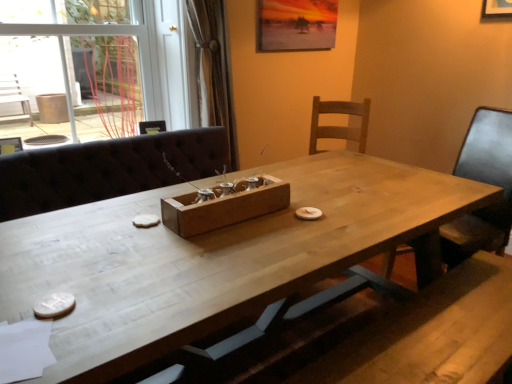
This screenshot has width=512, height=384. Describe the element at coordinates (483, 182) in the screenshot. I see `wooden chair at right` at that location.

This screenshot has height=384, width=512. What do you see at coordinates (214, 257) in the screenshot? I see `white wood table at center` at bounding box center [214, 257].

The image size is (512, 384). Find the location of `wooden chair at right`. wooden chair at right is located at coordinates (483, 182).

From the image's perspective, who appears lower, white wood table at center or wooden tray at center?

From the image's view, white wood table at center is below.

Is white wood table at center located outside wooden tray at center?

white wood table at center is positioned outside wooden tray at center.

In the scene shown: Would you say white wood table at center is a long distance from wooden tray at center?

No, white wood table at center is not far from wooden tray at center.

Considering the sizes of objects wooden tray at center and transparent glass door at upper left in the image provided, who is taller, wooden tray at center or transparent glass door at upper left?

Standing taller between the two is transparent glass door at upper left.

Consider the image. Would you consider wooden tray at center to be distant from transparent glass door at upper left?

Yes, wooden tray at center and transparent glass door at upper left are quite far apart.

Looking at their sizes, would you say wooden tray at center is wider or thinner than transparent glass door at upper left?

Clearly, wooden tray at center has less width compared to transparent glass door at upper left.

Can you confirm if wooden tray at center is positioned to the right of transparent glass door at upper left?

Yes.

Is wooden chair at right further to the viewer compared to white wood table at center?

That is True.

Where is `table below the wooden chair at right (from the image's perspective)`? table below the wooden chair at right (from the image's perspective) is located at coordinates (214, 257).

Does wooden chair at right have a lesser height compared to white wood table at center?

Incorrect, the height of wooden chair at right does not fall short of that of white wood table at center.

Is wooden chair at right aimed at white wood table at center?

Yes, wooden chair at right is aimed at white wood table at center.

Is transparent glass door at upper left in front of or behind white wood table at center in the image?

transparent glass door at upper left is behind white wood table at center.

Is transparent glass door at upper left smaller than white wood table at center?

Yes.

Which of these two, transparent glass door at upper left or white wood table at center, is thinner?

white wood table at center is thinner.

In the image, is transparent glass door at upper left on the left side or the right side of white wood table at center?

transparent glass door at upper left is positioned on white wood table at center's left side.

Consider the image. Considering the relative sizes of wooden chair at right and wooden tray at center in the image provided, is wooden chair at right thinner than wooden tray at center?

No.

Is wooden chair at right situated inside wooden tray at center or outside?

wooden chair at right is spatially situated outside wooden tray at center.

Is wooden chair at right far away from wooden tray at center?

That's right, there is a large distance between wooden chair at right and wooden tray at center.

Is wooden chair at right positioned behind wooden tray at center?

Yes.

Does white wood table at center have a smaller size compared to transparent glass door at upper left?

Actually, white wood table at center might be larger than transparent glass door at upper left.

Between point (452, 200) and point (190, 38), which one is positioned in front?

The point (452, 200) is closer.

Which is more to the right, white wood table at center or transparent glass door at upper left?

white wood table at center.

Which of these two, wooden tray at center or wooden chair at right, is smaller?

With smaller size is wooden tray at center.

Is wooden tray at center with wooden chair at right?

No.

The image size is (512, 384). I want to click on chair below the wooden tray at center (from the image's perspective), so click(483, 182).

The width and height of the screenshot is (512, 384). I want to click on cardboard box on the left of the white wood table at center, so click(223, 208).

Locate an element on the screen. The width and height of the screenshot is (512, 384). cardboard box located underneath the transparent glass door at upper left (from a real-world perspective) is located at coordinates (223, 208).

Considering their positions, is wooden tray at center positioned further to white wood table at center than wooden chair at right?

Based on the image, wooden chair at right appears to be further to white wood table at center.

Based on their spatial positions, is wooden chair at right or transparent glass door at upper left closer to wooden tray at center?

The object closer to wooden tray at center is wooden chair at right.

When comparing their distances from white wood table at center, does transparent glass door at upper left or wooden chair at right seem further?

transparent glass door at upper left.

Considering their positions, is transparent glass door at upper left positioned closer to white wood table at center than wooden tray at center?

The object closer to white wood table at center is wooden tray at center.

Based on their spatial positions, is transparent glass door at upper left or wooden chair at right closer to wooden tray at center?

Based on the image, wooden chair at right appears to be nearer to wooden tray at center.

Estimate the real-world distances between objects in this image. Which object is further from transparent glass door at upper left, wooden tray at center or white wood table at center?

Based on the image, wooden tray at center appears to be further to transparent glass door at upper left.

Considering their positions, is wooden tray at center positioned closer to white wood table at center than transparent glass door at upper left?

Based on the image, wooden tray at center appears to be nearer to white wood table at center.

Looking at the image, which one is located closer to transparent glass door at upper left, white wood table at center or wooden chair at right?

Among the two, white wood table at center is located nearer to transparent glass door at upper left.

At what (x,y) coordinates should I click in order to perform the action: click on cardboard box that lies between transparent glass door at upper left and white wood table at center from top to bottom. Please return your answer as a coordinate pair (x, y). This screenshot has width=512, height=384. Looking at the image, I should click on (223, 208).

The width and height of the screenshot is (512, 384). I want to click on table situated between transparent glass door at upper left and wooden chair at right from left to right, so coord(214,257).

The image size is (512, 384). What are the coordinates of `table between wooden tray at center and wooden chair at right from left to right` in the screenshot? It's located at (214, 257).

Find the location of a particular element. cardboard box between transparent glass door at upper left and wooden chair at right in the horizontal direction is located at coordinates (223, 208).